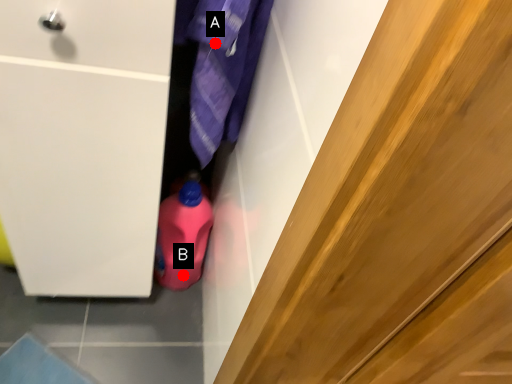
Question: Two points are circled on the image, labeled by A and B beside each circle. Which point is closer to the camera taking this photo?

Choices:
 (A) A is closer
 (B) B is closer

Answer: (A)